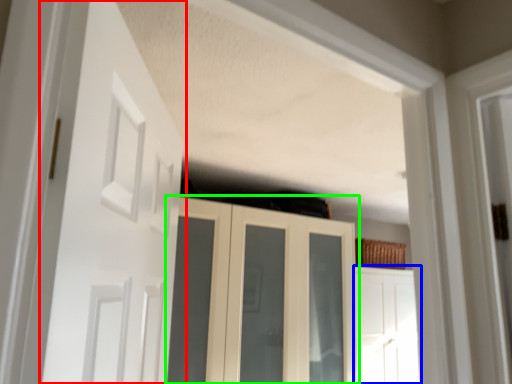
Question: Which is nearer to the door (highlighted by a red box)? door (highlighted by a blue box) or cupboard (highlighted by a green box).

Choices:
 (A) door
 (B) cupboard

Answer: (B)